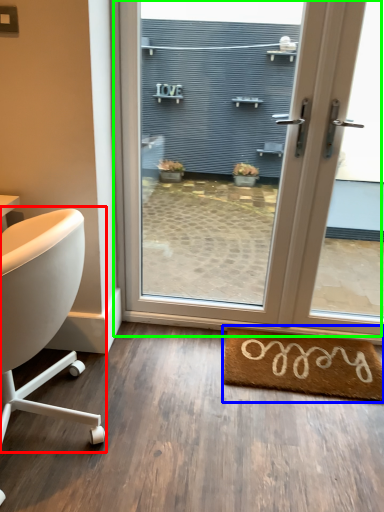
Question: Which is farther away from chair (highlighted by a red box)? mat (highlighted by a blue box) or door (highlighted by a green box)?

Choices:
 (A) mat
 (B) door

Answer: (A)